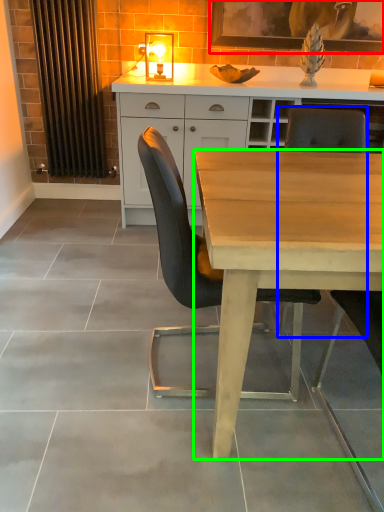
Question: Estimate the real-world distances between objects in this image. Which object is closer to picture frame (highlighted by a red box), chair (highlighted by a blue box) or desk (highlighted by a green box)?

Choices:
 (A) chair
 (B) desk

Answer: (A)